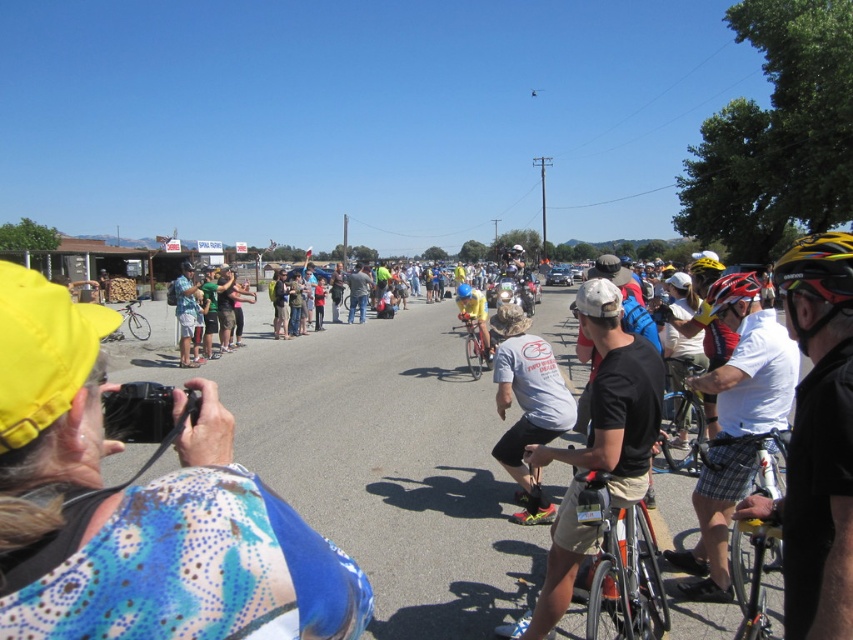
Does point (670, 410) lie in front of point (467, 298)?

Yes, point (670, 410) is closer to viewer.

Can you confirm if silver metallic bicycle at center is positioned to the right of matte yellow helmet at center?

Correct, you'll find silver metallic bicycle at center to the right of matte yellow helmet at center.

Who is more distant from viewer, (695, 417) or (466, 285)?

The point (466, 285) is behind.

This screenshot has width=853, height=640. Find the location of `silver metallic bicycle at center`. silver metallic bicycle at center is located at coordinates (680, 417).

Between point (749, 300) and point (485, 364), which one is positioned in front?

Point (749, 300) is in front.

The image size is (853, 640). What are the coordinates of `shiny red helmet at center` in the screenshot? It's located at (732, 291).

Between shiny red helmet at center and shiny silver bicycle at center, which one appears on the right side from the viewer's perspective?

Positioned to the right is shiny red helmet at center.

Between shiny red helmet at center and shiny silver bicycle at center, which one has more height?

Standing taller between the two is shiny silver bicycle at center.

You are a GUI agent. You are given a task and a screenshot of the screen. Output one action in this format:
    pyautogui.click(x=<x>, y=<y>)
    Task: Click on the shiny red helmet at center
    The image size is (853, 640).
    Given the screenshot: What is the action you would take?
    pyautogui.click(x=732, y=291)